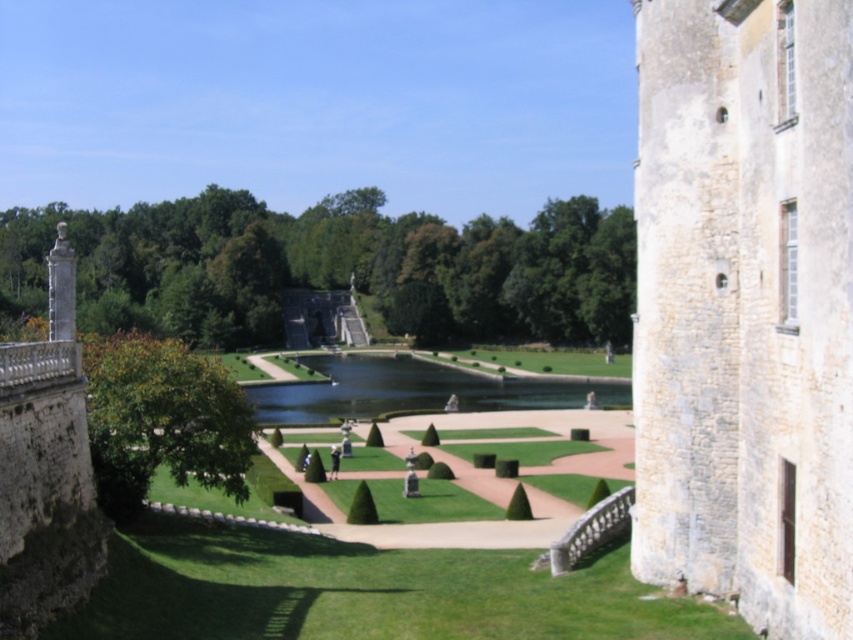
You are a visitor standing in the garden and want to take a photo of both the stone tower at right and the green grassy lake at center. Which object should you position closer to the camera to ensure both are in focus?

The stone tower at right is much taller than the green grassy lake at center, so you should position the stone tower at right closer to the camera to ensure both are in focus.